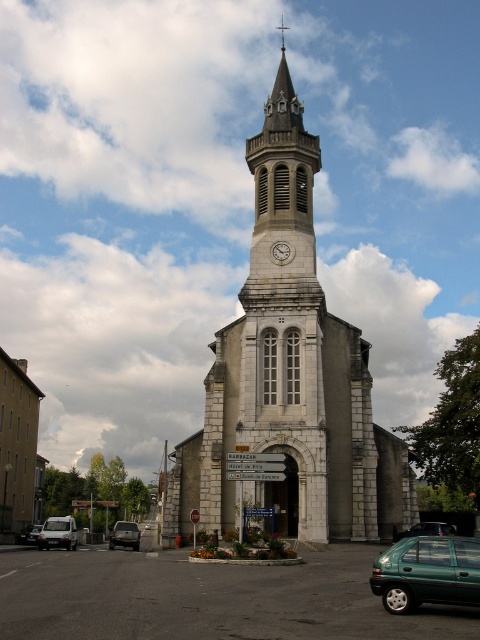
You are a visitor arriving at the church and need to park your car, which is 2 meters wide. The parking area is between the white stone clock tower at center and the green matte car at center. Can your car fit in the space between them?

The white stone clock tower at center is wider than the green matte car at center. Since the parking space between them must accommodate the width of both objects, and the tower is wider, the available space might be insufficient for a 2m wide car. However, without exact measurements, it is uncertain. Please check the actual dimensions before deciding.

Based on the photo, you are standing in front of the church and want to take a photo that includes both the bell tower and the parking area. You notice two points marked on the ground at coordinates point (x=252, y=392) and point (x=136, y=548). Which point should you stand closer to in order to ensure both the bell tower and the parking area are fully visible in your photo?

You should stand closer to point (x=252, y=392) because it is closer to the camera, allowing you to capture both the bell tower and the parking area in the frame.